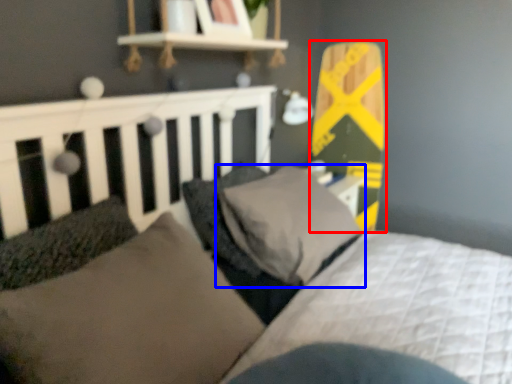
Question: Among these objects, which one is nearest to the camera, skateboard (highlighted by a red box) or pillow (highlighted by a blue box)?

Choices:
 (A) skateboard
 (B) pillow

Answer: (B)